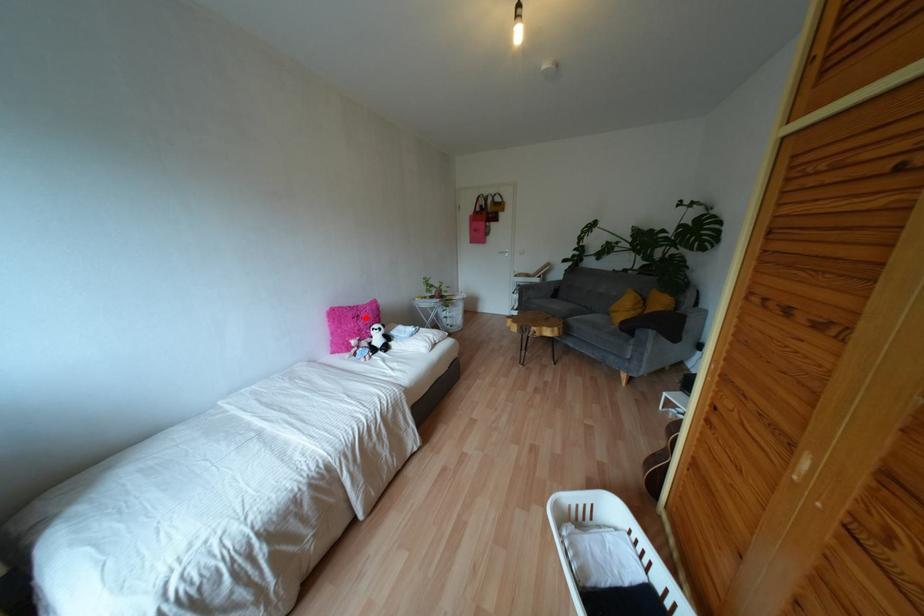
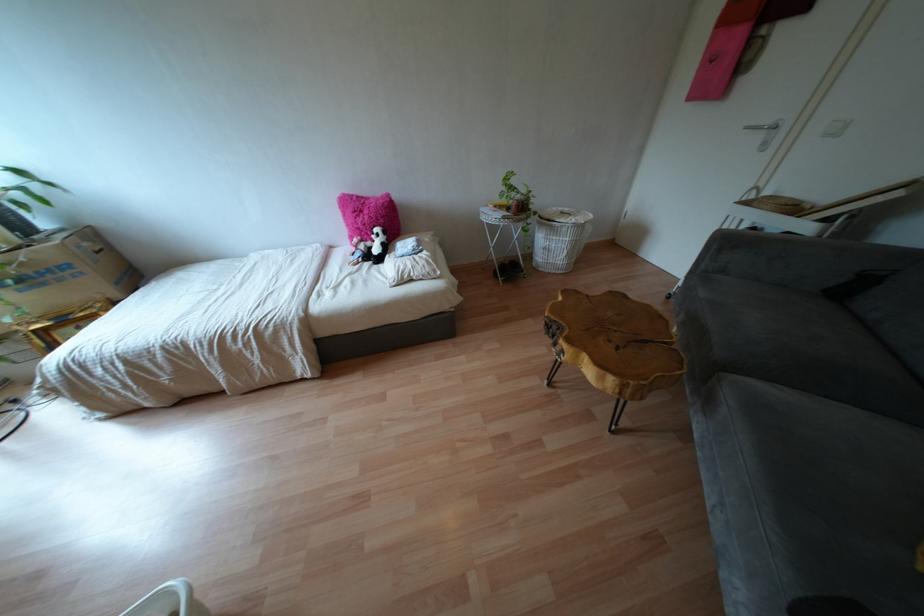
Question: I am providing you with two images of the same scene from different viewpoints. Given a red point in image1, look at the same physical point in image2. Is it:

Choices:
 (A) Closer to the viewpoint
 (B) Farther from the viewpoint

Answer: (A)